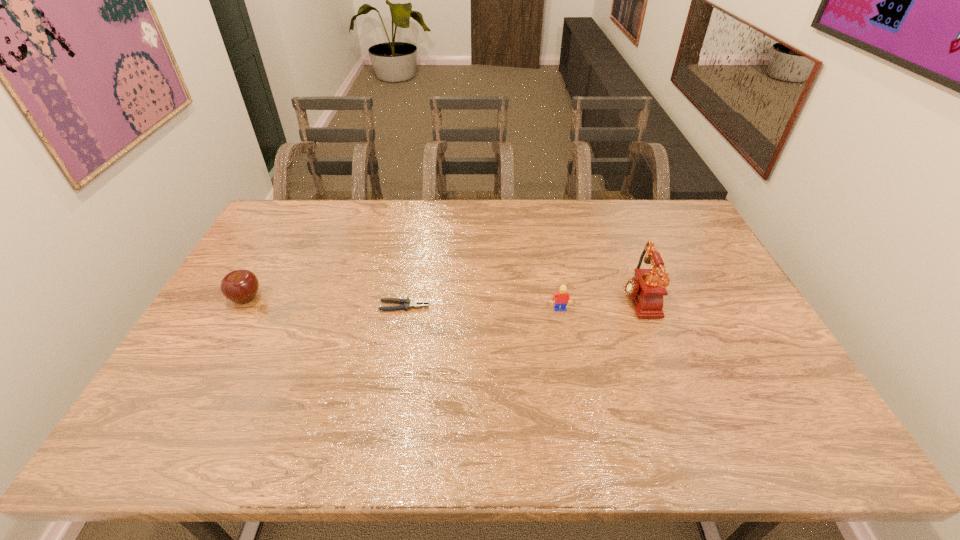
Identify the location of the rightmost object. (646, 289).

You are a GUI agent. You are given a task and a screenshot of the screen. Output one action in this format:
    pyautogui.click(x=<x>, y=<y>)
    Task: Click on the tallest object
    
    Given the screenshot: What is the action you would take?
    pyautogui.click(x=646, y=289)

At what (x,y) coordinates should I click in order to perform the action: click on apple. Please return your answer as a coordinate pair (x, y). Looking at the image, I should click on (240, 286).

Locate an element on the screen. Lego is located at coordinates (561, 297).

The height and width of the screenshot is (540, 960). What are the coordinates of `the shortest object` in the screenshot? It's located at (406, 303).

Image resolution: width=960 pixels, height=540 pixels. In order to click on the third object from right to left in this screenshot , I will do `click(406, 303)`.

At what (x,y) coordinates should I click in order to perform the action: click on blank space located 0.280m on the dial of the telephone. Please return your answer as a coordinate pair (x, y). This screenshot has height=540, width=960. Looking at the image, I should click on (526, 297).

You are a GUI agent. You are given a task and a screenshot of the screen. Output one action in this format:
    pyautogui.click(x=<x>, y=<y>)
    Task: Click on the free spot located 0.130m on the dial of the telephone
    
    Given the screenshot: What is the action you would take?
    pyautogui.click(x=576, y=297)

Identify the location of free space located 0.230m on the dial of the telephone. Image resolution: width=960 pixels, height=540 pixels. [542, 297].

Locate an element on the screen. The width and height of the screenshot is (960, 540). vacant area situated 0.100m on the back of the leftmost object is located at coordinates (264, 266).